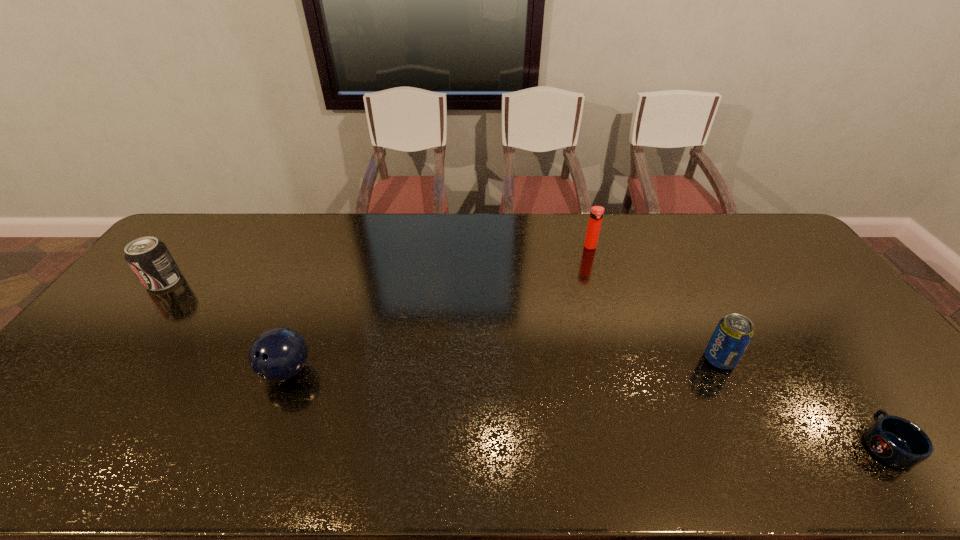
The height and width of the screenshot is (540, 960). Identify the location of the farthest object. (596, 214).

The image size is (960, 540). What are the coordinates of `the third object from left to right` in the screenshot? It's located at (596, 214).

Locate an element on the screen. This screenshot has height=540, width=960. the fourth nearest object is located at coordinates (149, 258).

Where is `the farther soda`? the farther soda is located at coordinates (149, 258).

Identify the location of the right soda. This screenshot has height=540, width=960. (734, 332).

Find the location of a particular element. the nearer soda is located at coordinates (734, 332).

Locate an element on the screen. The width and height of the screenshot is (960, 540). bowling ball is located at coordinates (278, 354).

Find the location of a particular element. This screenshot has height=540, width=960. the rightmost object is located at coordinates (898, 442).

You are a GUI agent. You are given a task and a screenshot of the screen. Output one action in this format:
    pyautogui.click(x=<x>, y=<y>)
    Task: Click on the nearest object
    
    Given the screenshot: What is the action you would take?
    pyautogui.click(x=898, y=442)

I want to click on vacant space positioned on the front of the thermos bottle, so click(x=616, y=333).